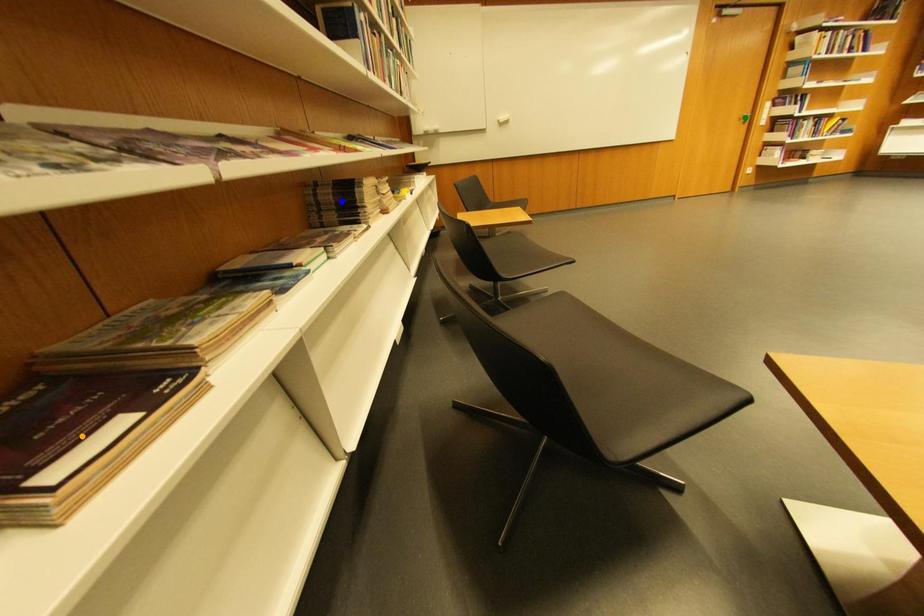
Order these from farthest to nearest:
- blue point
- orange point
- green point

1. green point
2. blue point
3. orange point